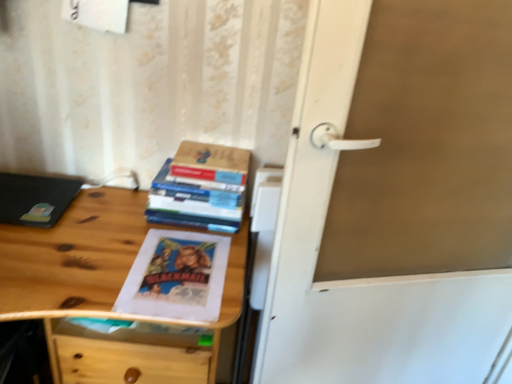
The image size is (512, 384). In order to click on hardcover book at upper center in this screenshot , I will do `click(211, 163)`.

Image resolution: width=512 pixels, height=384 pixels. What do you see at coordinates (201, 188) in the screenshot?
I see `hardcover books at center` at bounding box center [201, 188].

This screenshot has width=512, height=384. I want to click on wooden desk at left, so click(x=93, y=261).

Find the location of a particular element. matte black laptop at left is located at coordinates (35, 199).

From the image's perspective, is hardcover books at center located above or below hardcover book at upper center?

From the image's perspective, hardcover books at center appears below hardcover book at upper center.

Considering the positions of objects hardcover books at center and hardcover book at upper center in the image provided, who is behind, hardcover books at center or hardcover book at upper center?

hardcover book at upper center is further away from the camera.

From a real-world perspective, between hardcover books at center and hardcover book at upper center, who is vertically higher?

hardcover book at upper center, from a real-world perspective.

In the image, there is a hardcover books at center. Where is `paperback book above it (from the image's perspective)`? Image resolution: width=512 pixels, height=384 pixels. paperback book above it (from the image's perspective) is located at coordinates (211, 163).

Find the location of a particular element. The height and width of the screenshot is (384, 512). book located on the right of wooden desk at left is located at coordinates (201, 188).

Can you confirm if wooden desk at left is smaller than hardcover books at center?

Actually, wooden desk at left might be larger than hardcover books at center.

Considering the relative sizes of wooden desk at left and hardcover books at center in the image provided, is wooden desk at left shorter than hardcover books at center?

In fact, wooden desk at left may be taller than hardcover books at center.

Can you confirm if white matte door handle at center is thinner than hardcover books at center?

Yes, white matte door handle at center is thinner than hardcover books at center.

Considering the sizes of objects white matte door handle at center and hardcover books at center in the image provided, who is shorter, white matte door handle at center or hardcover books at center?

hardcover books at center.

Is white matte door handle at center with hardcover books at center?

There is a gap between white matte door handle at center and hardcover books at center.

From a real-world perspective, does hardcover books at center stand above white matte door handle at center?

Yes.

Considering the relative positions of hardcover books at center and white matte door handle at center in the image provided, is hardcover books at center to the right of white matte door handle at center from the viewer's perspective?

In fact, hardcover books at center is to the left of white matte door handle at center.

I want to click on door on the right of the hardcover books at center, so click(395, 199).

Can you confirm if hardcover books at center is wider than white matte door handle at center?

Yes, hardcover books at center is wider than white matte door handle at center.

Is white matte door handle at center a part of matte black laptop at left?

That's incorrect, white matte door handle at center is not inside matte black laptop at left.

Between matte black laptop at left and white matte door handle at center, which one appears on the right side from the viewer's perspective?

white matte door handle at center is more to the right.

Considering the positions of point (29, 201) and point (359, 14), is point (29, 201) closer or farther from the camera than point (359, 14)?

Clearly, point (29, 201) is more distant from the camera than point (359, 14).

From the picture: Considering the relative sizes of matte black laptop at left and white matte door handle at center in the image provided, is matte black laptop at left smaller than white matte door handle at center?

Correct, matte black laptop at left occupies less space than white matte door handle at center.

Does point (206, 221) come in front of point (64, 194)?

Yes, point (206, 221) is in front of point (64, 194).

Is hardcover books at center looking in the opposite direction of matte black laptop at left?

No, hardcover books at center is not facing away from matte black laptop at left.

Between hardcover books at center and matte black laptop at left, which one has smaller size?

Smaller between the two is matte black laptop at left.

Where is `book that is above the matte black laptop at left (from a real-world perspective)`? This screenshot has height=384, width=512. book that is above the matte black laptop at left (from a real-world perspective) is located at coordinates (201, 188).

Is white matte door handle at center located outside wooden desk at left?

Yes.

From a real-world perspective, is white matte door handle at center positioned under wooden desk at left based on gravity?

Actually, white matte door handle at center is physically above wooden desk at left in the real world.

Is wooden desk at left at the back of white matte door handle at center?

No, white matte door handle at center is not facing the opposite direction of wooden desk at left.

Measure the distance from white matte door handle at center to wooden desk at left.

white matte door handle at center is 18.60 inches away from wooden desk at left.

The width and height of the screenshot is (512, 384). I want to click on paperback book located on the right of hardcover books at center, so click(211, 163).

You are a GUI agent. You are given a task and a screenshot of the screen. Output one action in this format:
    pyautogui.click(x=<x>, y=<y>)
    Task: Click on the desk that appears below the hardcover books at center (from the image's perspective)
    
    Given the screenshot: What is the action you would take?
    pyautogui.click(x=93, y=261)

Based on their spatial positions, is matte black laptop at left or hardcover book at upper center further from wooden desk at left?

Based on the image, hardcover book at upper center appears to be further to wooden desk at left.

When comparing their distances from hardcover book at upper center, does white matte door handle at center or hardcover books at center seem further?

white matte door handle at center is further to hardcover book at upper center.

Estimate the real-world distances between objects in this image. Which object is closer to wooden desk at left, hardcover book at upper center or hardcover books at center?

hardcover books at center.

Looking at this image, when comparing their distances from matte black laptop at left, does hardcover books at center or white matte door handle at center seem further?

white matte door handle at center is positioned further to the anchor matte black laptop at left.

Considering their positions, is matte black laptop at left positioned closer to hardcover book at upper center than hardcover books at center?

hardcover books at center.

From the image, which object appears to be nearer to white matte door handle at center, hardcover books at center or hardcover book at upper center?

The object closer to white matte door handle at center is hardcover books at center.

Which object lies nearer to the anchor point hardcover books at center, white matte door handle at center or hardcover book at upper center?

Among the two, hardcover book at upper center is located nearer to hardcover books at center.

Estimate the real-world distances between objects in this image. Which object is closer to white matte door handle at center, matte black laptop at left or hardcover books at center?

hardcover books at center is positioned closer to the anchor white matte door handle at center.

Identify the location of paperback book located between wooden desk at left and white matte door handle at center in the left-right direction. (211, 163).

Find the location of `paperback book between matte black laptop at left and white matte door handle at center in the horizontal direction`. paperback book between matte black laptop at left and white matte door handle at center in the horizontal direction is located at coordinates (211, 163).

Locate an element on the screen. This screenshot has width=512, height=384. book between wooden desk at left and white matte door handle at center is located at coordinates (201, 188).

At what (x,y) coordinates should I click in order to perform the action: click on desk located between matte black laptop at left and hardcover books at center in the left-right direction. Please return your answer as a coordinate pair (x, y). Image resolution: width=512 pixels, height=384 pixels. Looking at the image, I should click on (93, 261).